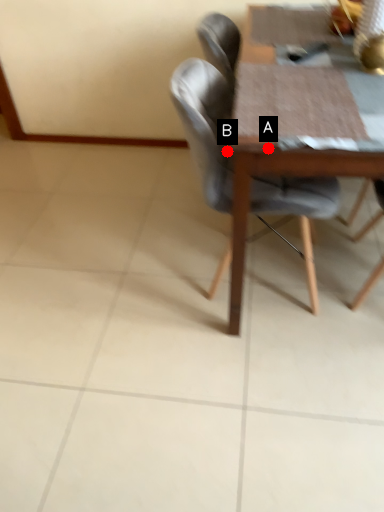
Question: Two points are circled on the image, labeled by A and B beside each circle. Among these points, which one is nearest to the camera?

Choices:
 (A) A is closer
 (B) B is closer

Answer: (A)